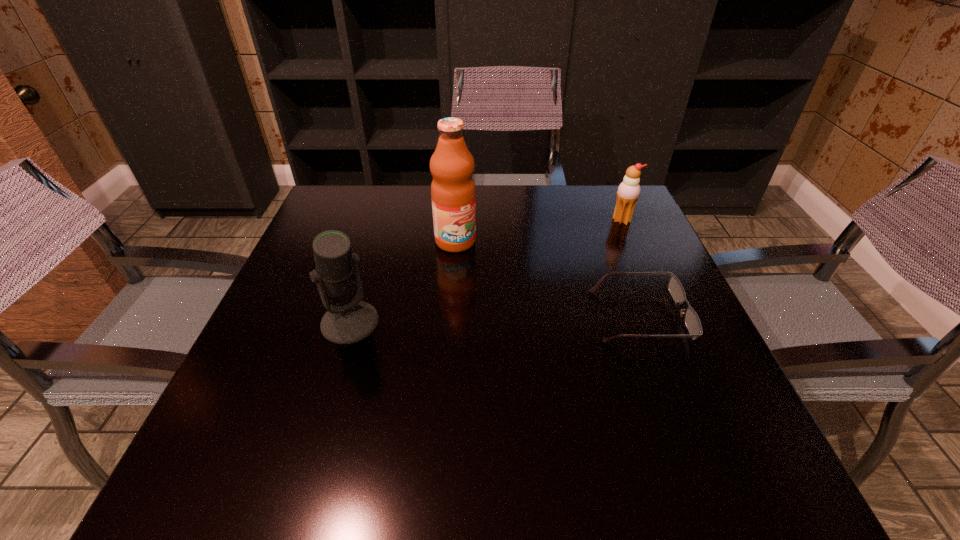
You are a GUI agent. You are given a task and a screenshot of the screen. Output one action in this format:
    pyautogui.click(x=<x>, y=<y>)
    Task: Click on the free point at the far edge
    Image resolution: width=960 pixels, height=540 pixels.
    Given the screenshot: What is the action you would take?
    pyautogui.click(x=503, y=218)

Identify the location of vacant space at the near edge. Image resolution: width=960 pixels, height=540 pixels. coord(463,408).

In the image, there is a desktop. Where is `vacant region at the left edge`? vacant region at the left edge is located at coordinates (244, 366).

At what (x,y) coordinates should I click in order to perform the action: click on free space at the right edge of the desktop. Please return your answer as a coordinate pair (x, y). Looking at the image, I should click on (647, 247).

Where is `vacant region at the near left corner of the desktop`? vacant region at the near left corner of the desktop is located at coordinates (209, 428).

What are the coordinates of `free region at the near right corner` in the screenshot? It's located at (655, 422).

Image resolution: width=960 pixels, height=540 pixels. I want to click on free space between the second object from left to right and the spectacles, so click(547, 279).

Image resolution: width=960 pixels, height=540 pixels. Find the location of `free point between the tallest object and the farthest object`. free point between the tallest object and the farthest object is located at coordinates (539, 231).

In order to click on free spot between the tallest object and the leftmost object in this screenshot , I will do `click(403, 282)`.

You are a GUI agent. You are given a task and a screenshot of the screen. Output one action in this format:
    pyautogui.click(x=<x>, y=<y>)
    Task: Click on the vacant space in between the spectacles and the icecream
    This screenshot has height=540, width=960.
    Given the screenshot: What is the action you would take?
    pyautogui.click(x=631, y=268)